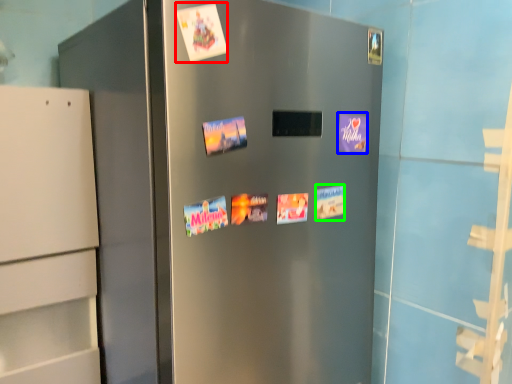
Question: Estimate the real-world distances between objects in this image. Which object is farther from flyer (highlighted by a red box), postcard (highlighted by a blue box) or postcard (highlighted by a green box)?

Choices:
 (A) postcard
 (B) postcard

Answer: (B)